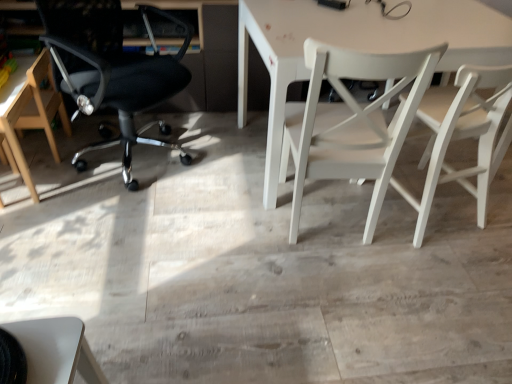
In order to click on vacant area that is in front of white matte table at center in this screenshot , I will do `click(344, 288)`.